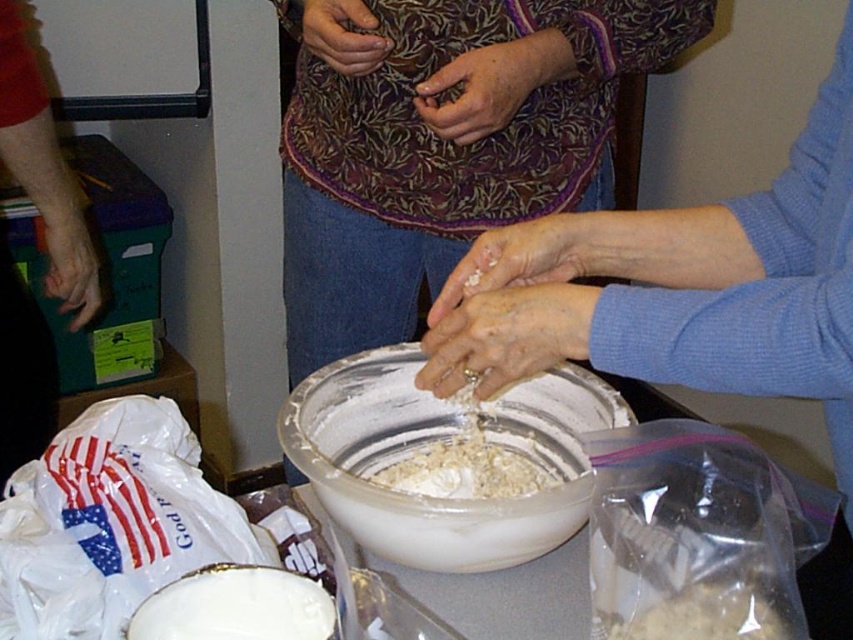
Question: Is the position of white powdery flour at center less distant than that of matte brown fabric at center?

Choices:
 (A) no
 (B) yes

Answer: (B)

Question: Which object is farther from the camera taking this photo?

Choices:
 (A) smooth white hands at center
 (B) white plastic bowl at center
 (C) white powdery flour at center

Answer: (C)

Question: Which point is closer to the camera taking this photo?

Choices:
 (A) (471, 566)
 (B) (85, 298)

Answer: (A)

Question: Does white matte bowl at center appear over matte floral fabric at center?

Choices:
 (A) no
 (B) yes

Answer: (A)

Question: Where is white powdery flour at center located in relation to matte brown fabric at center in the image?

Choices:
 (A) left
 (B) right

Answer: (B)

Question: Among these objects, which one is farthest from the camera?

Choices:
 (A) white powdery flour at center
 (B) white matte bowl at center
 (C) matte brown fabric at center

Answer: (C)